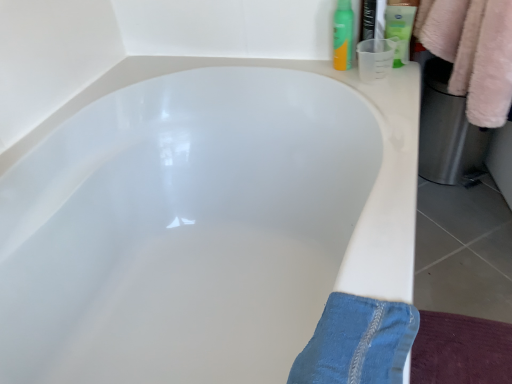
At what (x,y) coordinates should I click in order to perform the action: click on free space to the left of green matte spray can at upper right, marked as the second toiletry in a right-to-left arrangement. Please return your answer as a coordinate pair (x, y). The image size is (512, 384). Looking at the image, I should click on (297, 65).